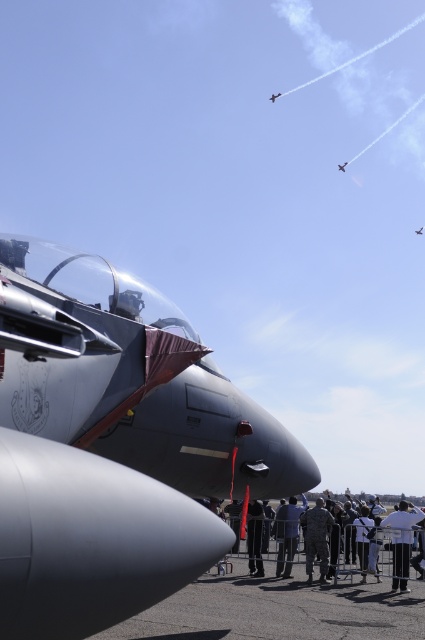
Question: Is white fabric shirt at lower right thinner than metallic silver jet at upper center?

Choices:
 (A) yes
 (B) no

Answer: (A)

Question: Can you confirm if black fabric pants at lower center is thinner than metallic silver jet at upper center?

Choices:
 (A) no
 (B) yes

Answer: (B)

Question: Which point is farther from the camera taking this photo?

Choices:
 (A) (258, 568)
 (B) (422, 234)
 (C) (340, 164)
 (D) (323, 544)

Answer: (B)

Question: Which object is positioned farthest from the metallic silver jet at upper center?

Choices:
 (A) black fabric pants at lower center
 (B) matte gray jet at upper center

Answer: (A)

Question: Among these points, which one is nearest to the camera?

Choices:
 (A) (277, 96)
 (B) (343, 163)

Answer: (A)

Question: Considering the relative positions of matte gray jet at center and black fabric pants at lower center in the image provided, where is matte gray jet at center located with respect to black fabric pants at lower center?

Choices:
 (A) left
 (B) right

Answer: (A)